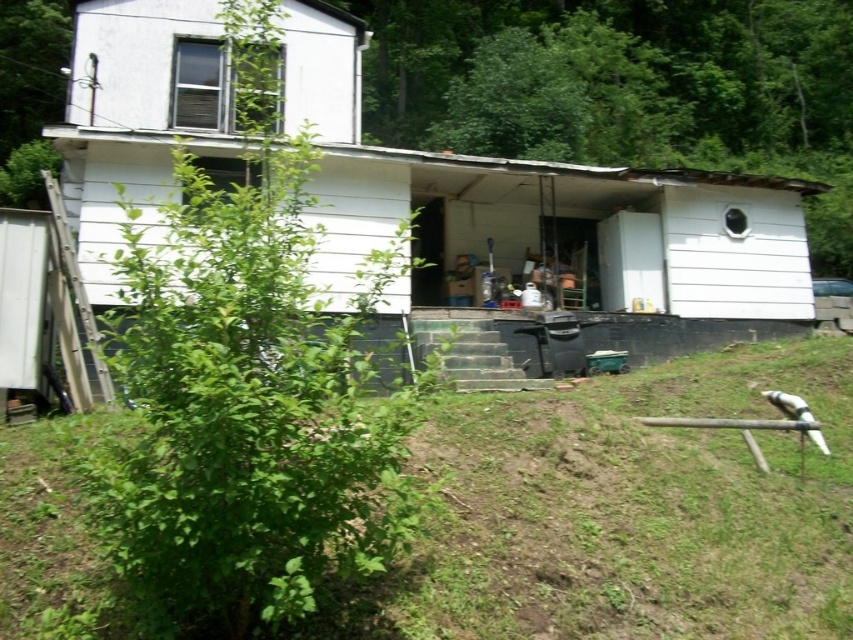
Question: Based on their relative distances, which object is farther from the green leafy bush at center?

Choices:
 (A) green grass at lower left
 (B) white matte shed at center

Answer: (B)

Question: Which point is farther to the camera?

Choices:
 (A) white matte shed at center
 (B) green grass at lower left
 (C) green leafy bush at center

Answer: (A)

Question: Which of the following is the closest to the observer?

Choices:
 (A) (427, 196)
 (B) (463, 426)
 (C) (164, 378)

Answer: (C)

Question: Can you confirm if green grass at lower left is positioned above green leafy bush at center?

Choices:
 (A) yes
 (B) no

Answer: (B)

Question: Does green grass at lower left have a lesser width compared to green leafy bush at center?

Choices:
 (A) no
 (B) yes

Answer: (A)

Question: Can you confirm if green grass at lower left is positioned above green leafy bush at center?

Choices:
 (A) no
 (B) yes

Answer: (A)